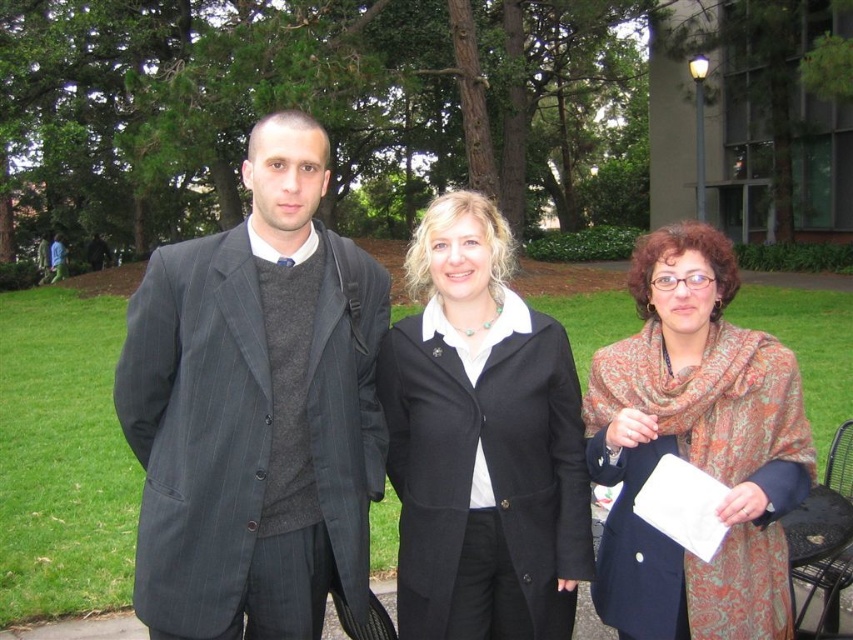
Which is more to the left, matte black suit at center or dark gray pinstripe suit at center?

dark gray pinstripe suit at center

Is point (210, 577) positioned in front of point (212, 436)?

Yes, it is.

The height and width of the screenshot is (640, 853). In order to click on matte black suit at center in this screenshot , I will do click(x=274, y=417).

Which is in front, point (247, 388) or point (480, 429)?

Positioned in front is point (247, 388).

Can you confirm if matte black suit at center is wider than black wool coat at center?

Yes, matte black suit at center is wider than black wool coat at center.

Identify the location of matte black suit at center. The height and width of the screenshot is (640, 853). (274, 417).

How much distance is there between black wool coat at center and patterned scarf at center?

44.17 centimeters

Who is shorter, black wool coat at center or patterned scarf at center?

patterned scarf at center

Does point (404, 428) come behind point (654, 264)?

Yes.

Identify the location of black wool coat at center. The image size is (853, 640). (482, 442).